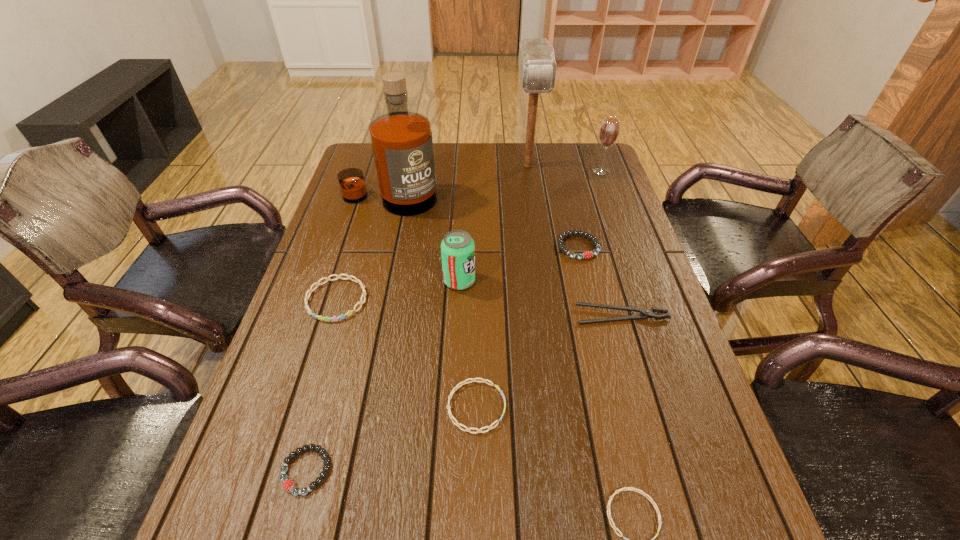
Image resolution: width=960 pixels, height=540 pixels. Find the location of `free space at the far edge`. free space at the far edge is located at coordinates (500, 163).

In the image, there is a desktop. In order to click on vacant region at the left edge in this screenshot , I will do `click(380, 235)`.

At what (x,y) coordinates should I click in order to perform the action: click on free space at the right edge of the desktop. Please return your answer as a coordinate pair (x, y). Looking at the image, I should click on (598, 311).

Image resolution: width=960 pixels, height=540 pixels. Find the location of `vacant space at the far right corner`. vacant space at the far right corner is located at coordinates (578, 156).

Find the location of a particular element. This screenshot has width=960, height=540. free space between the left black bracelet and the fifth object from right to left is located at coordinates (417, 318).

At what (x,y) coordinates should I click in order to perform the action: click on blank region between the third bracelet from right to left and the pop soda. Please return your answer as a coordinate pair (x, y). Looking at the image, I should click on (468, 344).

The height and width of the screenshot is (540, 960). What are the coordinates of `free space between the third tallest object and the smaller black bracelet` in the screenshot? It's located at coord(454,321).

Identify the location of empty location between the pop soda and the left black bracelet. The image size is (960, 540). (383, 376).

At what (x,y) coordinates should I click in order to perform the action: click on empty location between the third bracelet from right to left and the mallet. Please return your answer as a coordinate pair (x, y). The height and width of the screenshot is (540, 960). Looking at the image, I should click on (502, 286).

Locate an element on the screen. The height and width of the screenshot is (540, 960). free spot between the bigger black bracelet and the seventh shortest object is located at coordinates (518, 264).